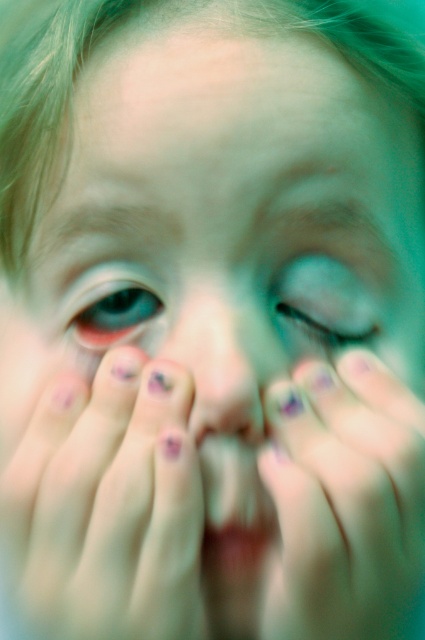
You are a photographer standing 10 inches away from the subject. You want to capture a closeup of the purple painted nails at center. Is the current distance sufficient to ensure the nails are in focus?

The purple painted nails at center are 8.37 inches away from the viewer. Since you are standing 10 inches away, you are slightly farther than the nails, so adjusting to be closer than 8.37 inches would ensure they are in focus.